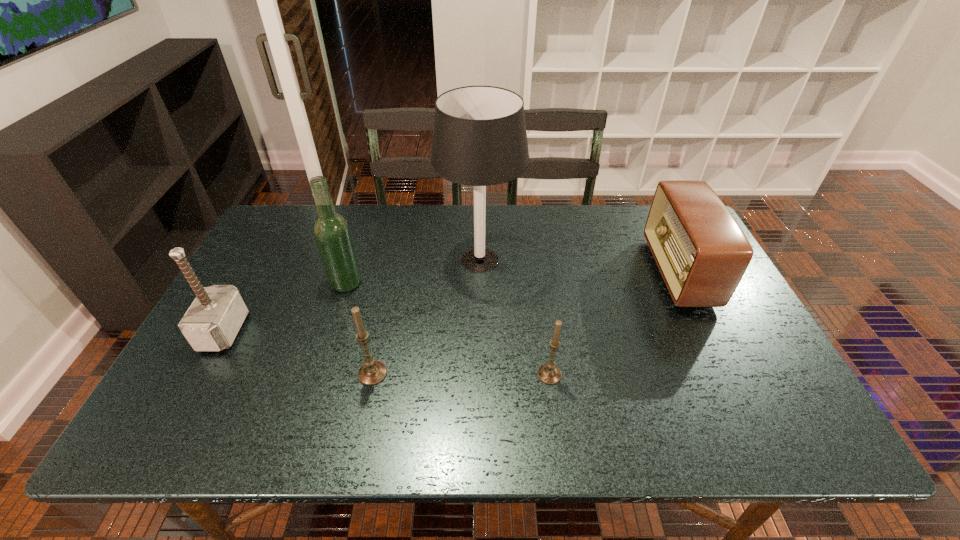
Please point a spot on the right to add another candle. Please provide its 2D coordinates. Your answer should be formatted as a tuple, i.e. [(x, y)], where the tuple contains the x and y coordinates of a point satisfying the conditions above.

[(727, 376)]